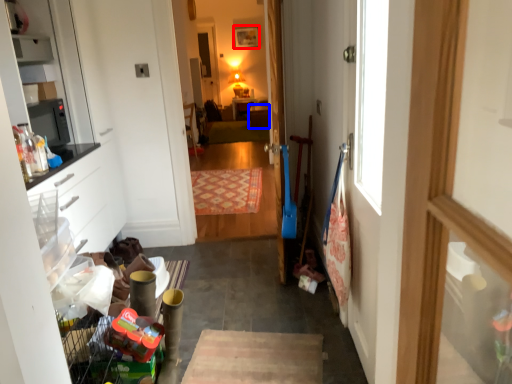
Question: Among these objects, which one is farthest to the camera, picture frame (highlighted by a red box) or cabinetry (highlighted by a blue box)?

Choices:
 (A) picture frame
 (B) cabinetry

Answer: (A)